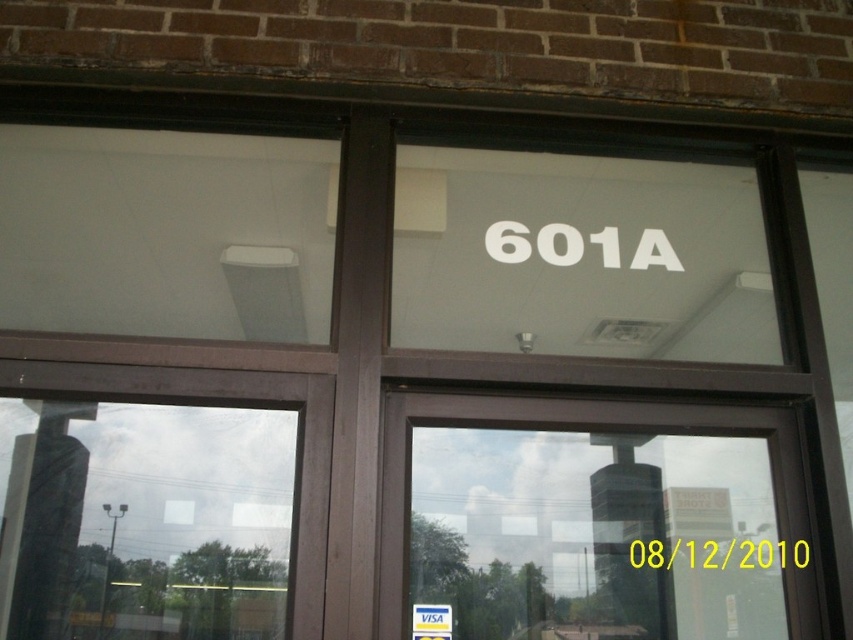
Question: Which point is closer to the camera?

Choices:
 (A) transparent glass door at center
 (B) white plastic visa card at center

Answer: (A)

Question: Which point is closer to the camera taking this photo?

Choices:
 (A) (426, 625)
 (B) (808, 548)

Answer: (A)

Question: Does transparent glass door at center appear on the right side of white plastic visa card at center?

Choices:
 (A) yes
 (B) no

Answer: (A)

Question: Does transparent glass door at center appear on the left side of white plastic visa card at center?

Choices:
 (A) yes
 (B) no

Answer: (B)

Question: Which point is closer to the camera taking this photo?

Choices:
 (A) (440, 611)
 (B) (538, 417)

Answer: (A)

Question: Is transparent glass door at center bigger than white plastic visa card at center?

Choices:
 (A) no
 (B) yes

Answer: (B)